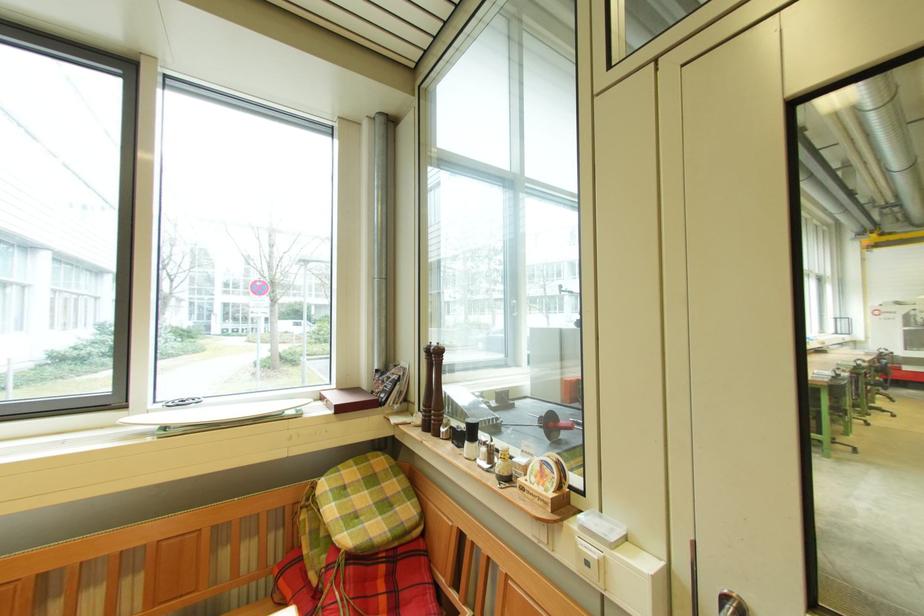
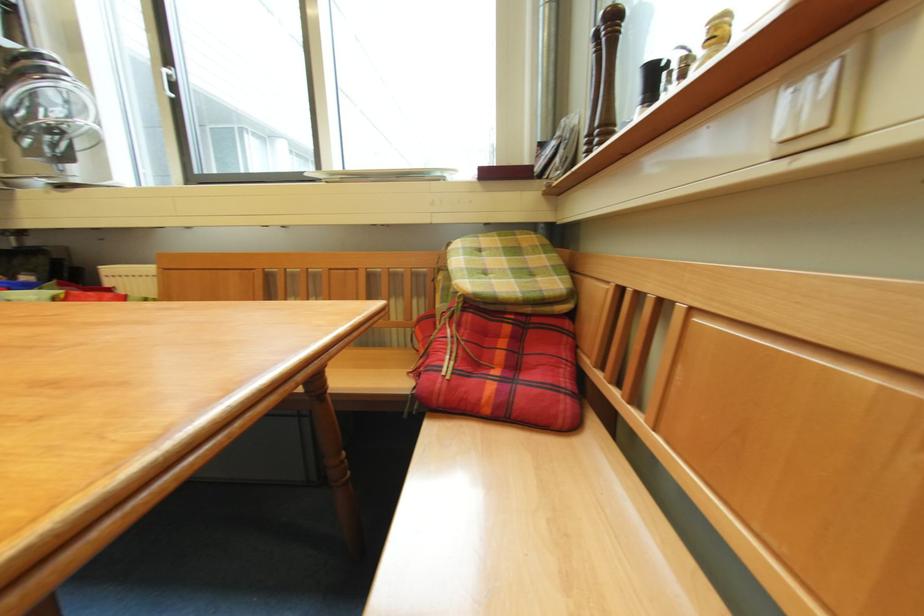
Question: The camera is either moving clockwise (left) or counter-clockwise (right) around the object. The first image is from the beginning of the video and the second image is from the end. Is the camera moving left or right when shooting the video?

Choices:
 (A) Left
 (B) Right

Answer: (B)